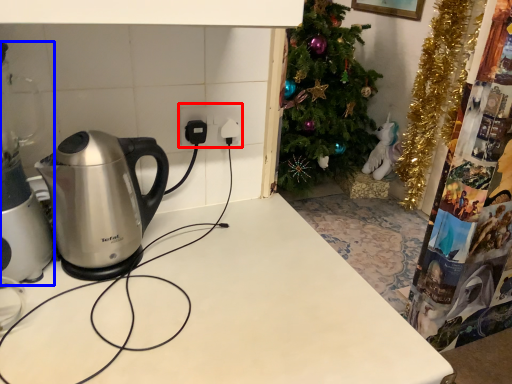
Question: Which of the following is the farthest to the observer, electric outlet (highlighted by a red box) or appliance (highlighted by a blue box)?

Choices:
 (A) electric outlet
 (B) appliance

Answer: (A)